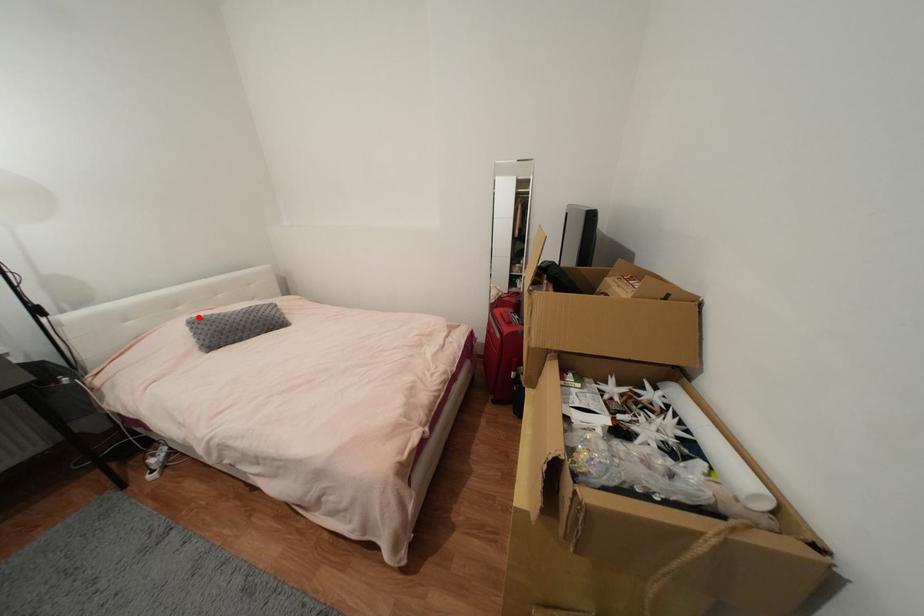
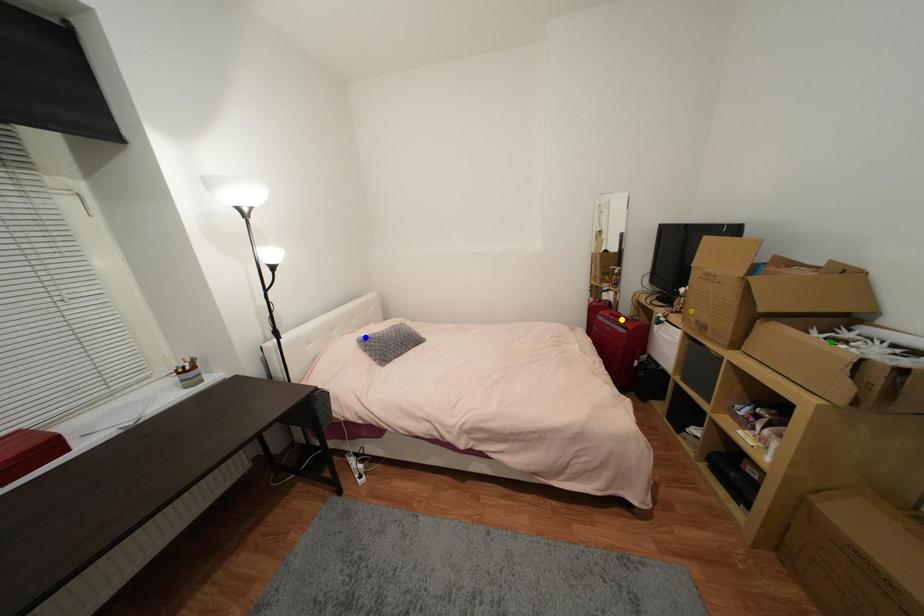
Question: I am providing you with two images of the same scene from different viewpoints. A red point is marked on the first image. You are given multiple points on the second image. Can you choose the point in image 2 that corresponds to the point in image 1?

Choices:
 (A) green point
 (B) yellow point
 (C) blue point

Answer: (C)